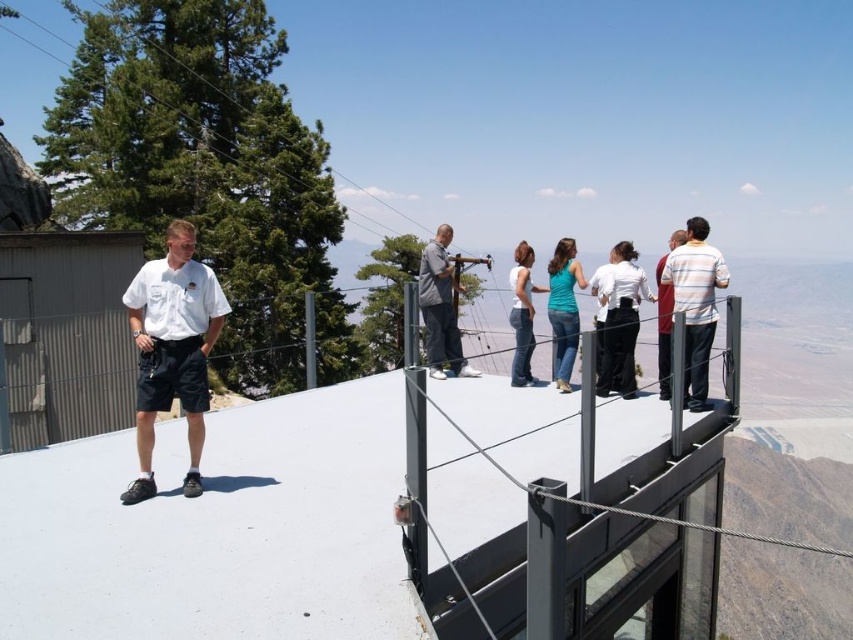
You are a visitor on the glass observation deck and want to take a photo of the landscape. The white matte shirt at left and the gray fabric jacket at center are blocking your view. Based on their positions, which person should you ask to move so you can see the landscape better?

The white matte shirt at left is in front of the gray fabric jacket at center, so you should ask the white matte shirt at left to move to get a clearer view of the landscape.

You are a visitor at the observation deck and want to know if the white matte shirt at left is wider than the gray fabric jacket at center. Can you determine this based on the scene?

The white matte shirt at left has a lesser width compared to gray fabric jacket at center, so the gray fabric jacket at center is wider than the white matte shirt at left.

You are a tour guide leading a group on the glass observation deck. You notice two visitors wearing a white matte shirt at center and a striped shirt at center. Which visitor is shorter?

The white matte shirt at center is shorter than the striped shirt at center.